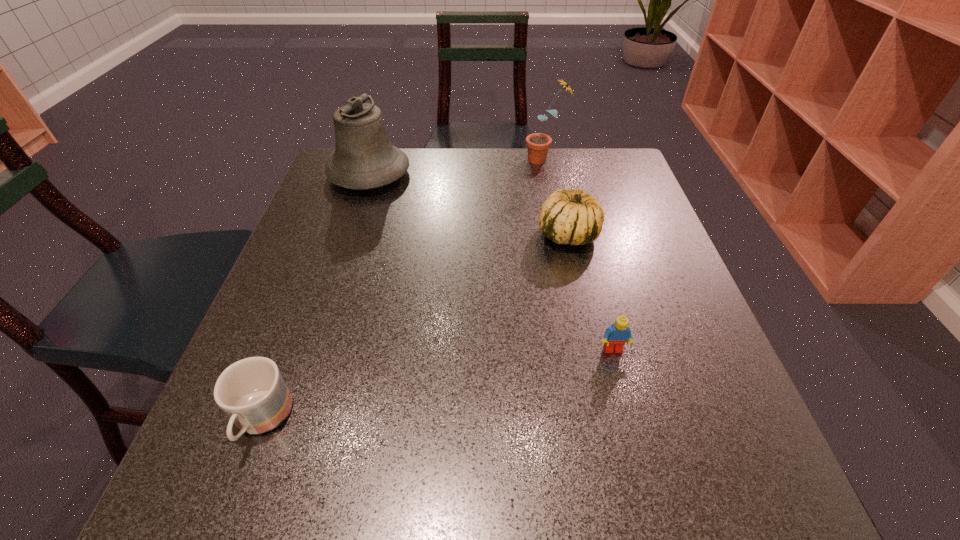
Locate an element on the screen. object that is the nearest to the bell is located at coordinates (538, 144).

Locate an element on the screen. This screenshot has height=540, width=960. free spot that satisfies the following two spatial constraints: 1. on the flower of the sunflower; 2. on the side with the handle of the nearest object is located at coordinates 596,420.